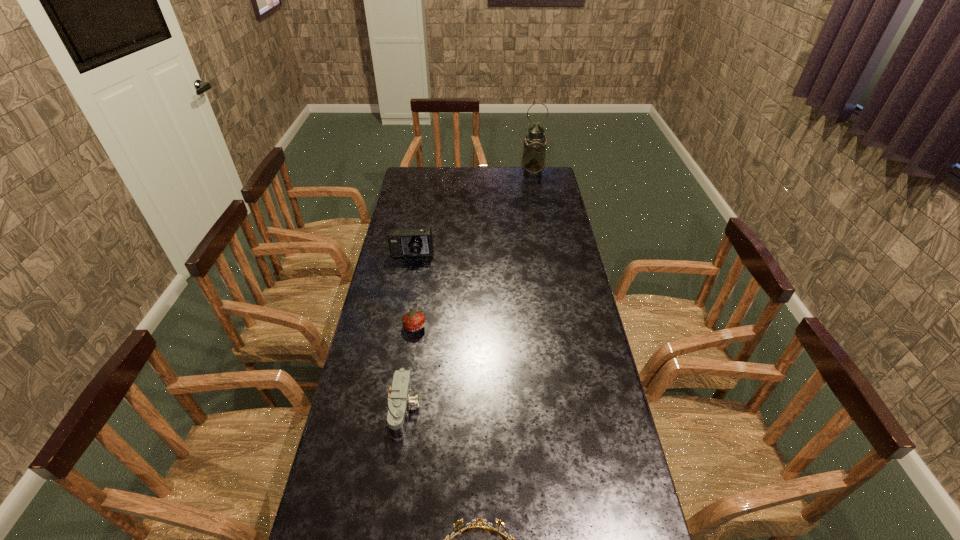
This screenshot has height=540, width=960. What are the coordinates of `vacant area located 0.210m on the right of the tomato` in the screenshot? It's located at (489, 326).

At what (x,y) coordinates should I click in order to perform the action: click on object that is at the far edge. Please return your answer as a coordinate pair (x, y). Looking at the image, I should click on (533, 162).

Locate an element on the screen. tomato located at the left edge is located at coordinates (413, 321).

You are a GUI agent. You are given a task and a screenshot of the screen. Output one action in this format:
    pyautogui.click(x=<x>, y=<y>)
    Task: Click on the object present at the right edge
    The width and height of the screenshot is (960, 540).
    Given the screenshot: What is the action you would take?
    pyautogui.click(x=533, y=162)

Locate an element on the screen. object that is positioned at the far right corner is located at coordinates (533, 162).

Where is `vacant space at the far edge`? vacant space at the far edge is located at coordinates (455, 168).

The image size is (960, 540). In the image, there is a desktop. Identify the location of vacant space at the left edge. (326, 525).

You are a GUI agent. You are given a task and a screenshot of the screen. Output one action in this format:
    pyautogui.click(x=<x>, y=<y>)
    Task: Click on the free space at the right edge of the desktop
    The width and height of the screenshot is (960, 540).
    Given the screenshot: What is the action you would take?
    pyautogui.click(x=536, y=212)

The image size is (960, 540). I want to click on vacant space at the far right corner of the desktop, so click(x=526, y=190).

Where is `free space between the oil lamp and the farther camera`? free space between the oil lamp and the farther camera is located at coordinates (472, 215).